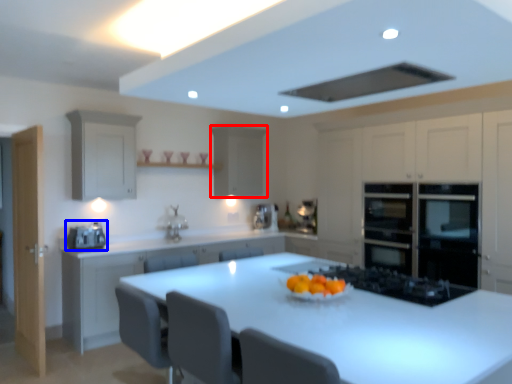
Question: Which point is closer to the camera, cabinetry (highlighted by a red box) or home appliance (highlighted by a blue box)?

Choices:
 (A) cabinetry
 (B) home appliance

Answer: (B)